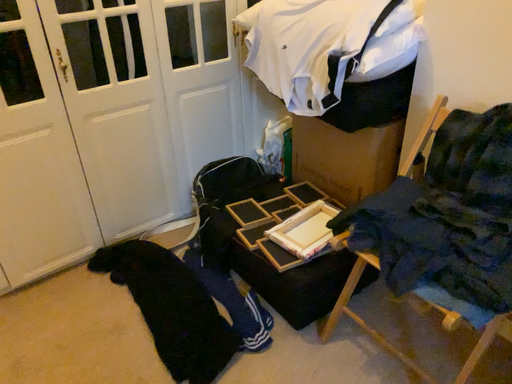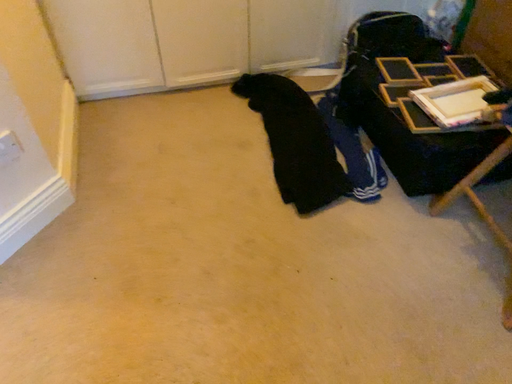
Question: Which way did the camera rotate in the video?

Choices:
 (A) rotated downward
 (B) rotated upward

Answer: (A)